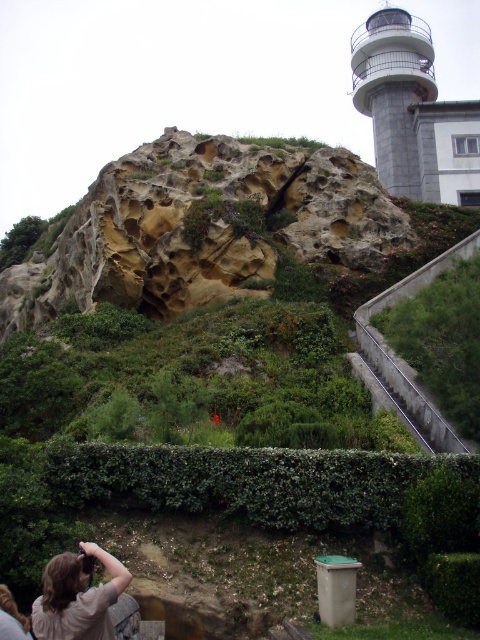
Question: Which object appears farthest from the camera in this image?

Choices:
 (A) green leafy shrub at lower right
 (B) light brown hair at lower left

Answer: (A)

Question: Is green leafy hedge at lower center behind green leafy shrub at lower right?

Choices:
 (A) yes
 (B) no

Answer: (B)

Question: Is green leafy hedge at lower center to the right of green leafy shrub at lower right from the viewer's perspective?

Choices:
 (A) yes
 (B) no

Answer: (B)

Question: Which point is farther to the camera?

Choices:
 (A) green leafy shrub at lower right
 (B) yellowish stone rock at center
 (C) light brown hair at lower left

Answer: (B)

Question: Can you confirm if white stone tower at upper right is bigger than light brown hair at lower left?

Choices:
 (A) yes
 (B) no

Answer: (A)

Question: Which point is farther to the camera?

Choices:
 (A) yellowish stone rock at center
 (B) light brown hair at lower left
 (C) green leafy shrub at lower right

Answer: (A)